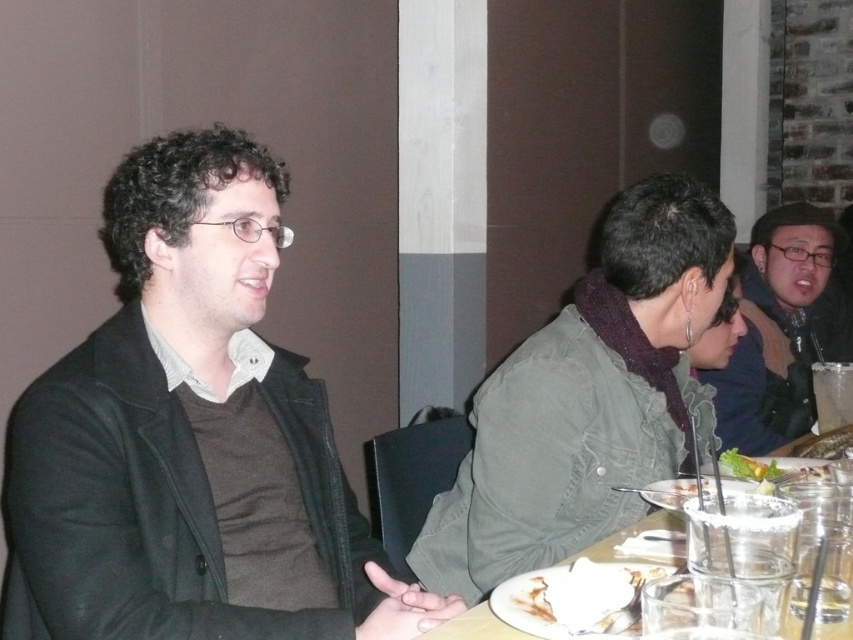
Who is shorter, matte black jacket at left or wooden table at center?

With less height is wooden table at center.

Describe the element at coordinates (190, 436) in the screenshot. I see `matte black jacket at left` at that location.

Is point (265, 404) less distant than point (498, 637)?

No, it is not.

Locate an element on the screen. This screenshot has height=640, width=853. matte black jacket at left is located at coordinates (190, 436).

Who is higher up, green denim jacket at center or wooden table at center?

Positioned higher is green denim jacket at center.

What are the coordinates of `green denim jacket at center` in the screenshot? It's located at (587, 397).

Find the location of `green denim jacket at center`. green denim jacket at center is located at coordinates (587, 397).

Is point (311, 406) farther from viewer compared to point (756, 304)?

That is False.

The width and height of the screenshot is (853, 640). Find the location of `matte black jacket at left`. matte black jacket at left is located at coordinates (190, 436).

The width and height of the screenshot is (853, 640). In order to click on matte black jacket at left in this screenshot , I will do `click(190, 436)`.